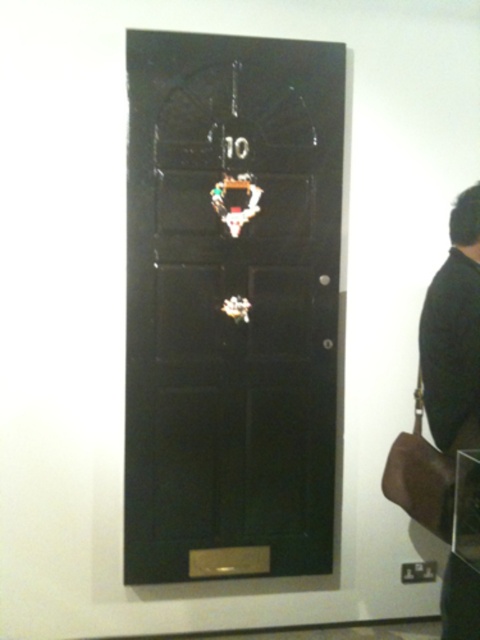
You are a painter who needs to paint both the glossy black door at center and the black leather jacket at right. Which object requires more paint because it has a larger surface area?

The glossy black door at center requires more paint because it is much taller than the black leather jacket at right, indicating it has a larger surface area.

You are trying to hang a black leather jacket at right on the glossy black door at center. Since both are black, will you be able to see the jacket clearly against the door?

The glossy black door at center is larger in size than black leather jacket at right, so yes, you will be able to see the jacket clearly against the door.

You are a delivery person trying to hand a package to the resident. You see the glossy black door at center and the black leather jacket at right. Which object is closer to you?

The glossy black door at center is closer to you because the black leather jacket at right is behind it.